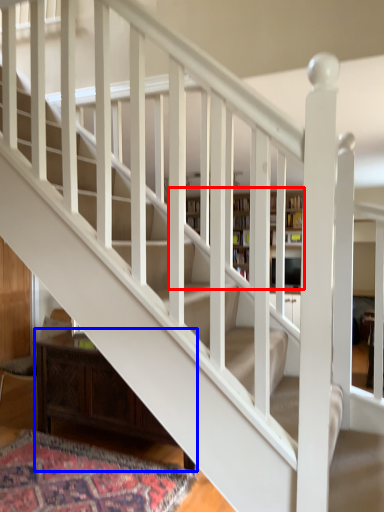
Question: Among these objects, which one is farthest to the camera, bookcase (highlighted by a red box) or furniture (highlighted by a blue box)?

Choices:
 (A) bookcase
 (B) furniture

Answer: (A)